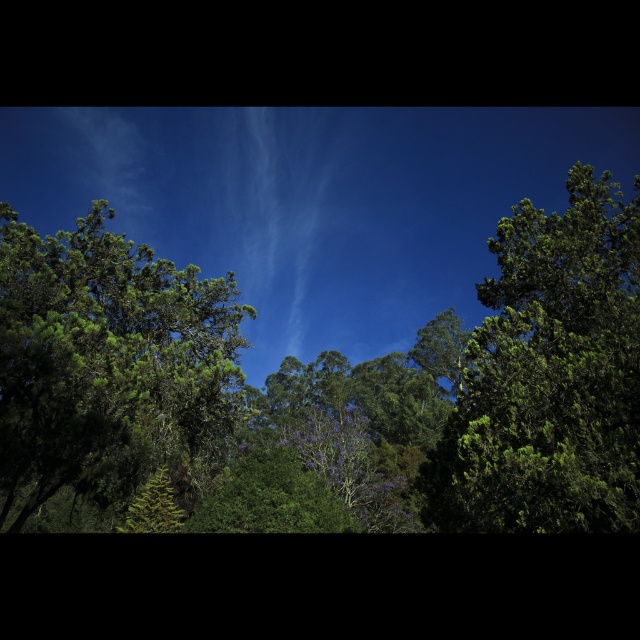
You are a hiker standing between the green leafy tree at right and the green leafy tree at center. You want to place a 30 meter long rope between them to hang a hammock. Will the rope be long enough?

The distance between the green leafy tree at right and the green leafy tree at center is 28.63 meters. Since the rope is 30 meters long, it will be long enough to span the distance between them.

You are an observer standing in the forest looking at the scene. You see the green leafy tree at left and the green leafy tree at center. Which tree appears closer to you based on their positions?

The green leafy tree at left appears closer because it is located below the green leafy tree at center, indicating it is in a lower position relative to the observer.